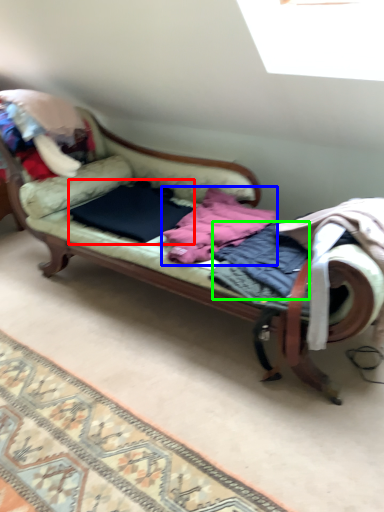
Question: Which is farther away from clothing (highlighted by a red box)? clothing (highlighted by a blue box) or clothing (highlighted by a green box)?

Choices:
 (A) clothing
 (B) clothing

Answer: (B)